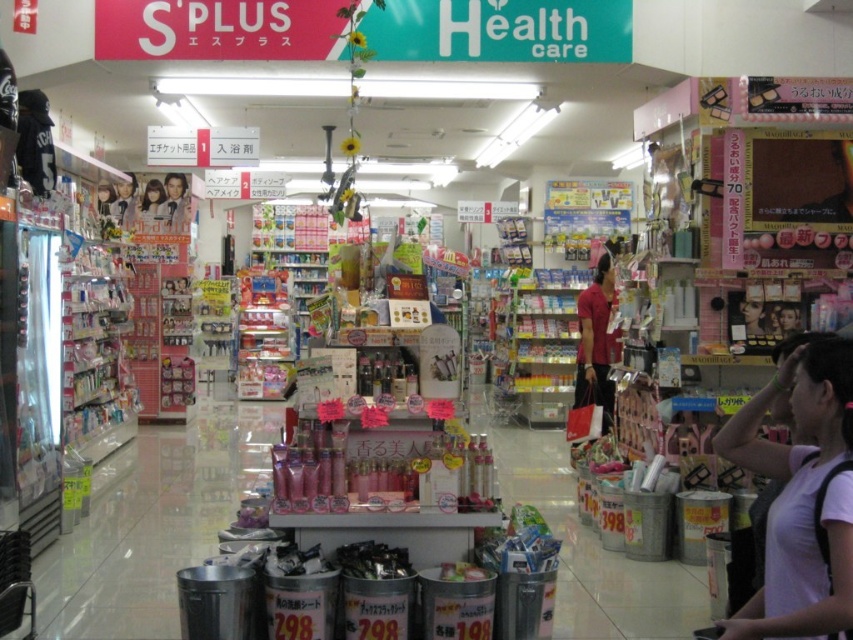
Is red matte t-shirt at center to the right of matte black hair at left from the viewer's perspective?

Correct, you'll find red matte t-shirt at center to the right of matte black hair at left.

From the picture: Is red matte t-shirt at center positioned before matte black hair at left?

Yes, it is in front of matte black hair at left.

Where is `red matte t-shirt at center`? The image size is (853, 640). red matte t-shirt at center is located at coordinates (596, 340).

The height and width of the screenshot is (640, 853). Identify the location of red matte t-shirt at center. (596, 340).

Can you confirm if red matte t-shirt at center is smaller than smooth skin portrait at upper left?

No, red matte t-shirt at center is not smaller than smooth skin portrait at upper left.

Measure the distance between point [579,360] and camera.

30.03 feet

What do you see at coordinates (596, 340) in the screenshot? The height and width of the screenshot is (640, 853). I see `red matte t-shirt at center` at bounding box center [596, 340].

Image resolution: width=853 pixels, height=640 pixels. I want to click on red matte t-shirt at center, so click(596, 340).

Is white matte shirt at lower right taller than smooth skin doll at upper left?

Indeed, white matte shirt at lower right has a greater height compared to smooth skin doll at upper left.

Which is in front, point (816, 364) or point (148, 212)?

Point (816, 364) is in front.

Is point (804, 394) positioned after point (154, 192)?

No.

Where is `white matte shirt at lower right`? The width and height of the screenshot is (853, 640). white matte shirt at lower right is located at coordinates (799, 497).